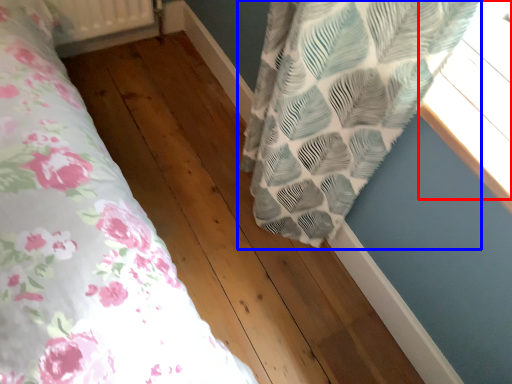
Question: Which of the following is the closest to the observer, window (highlighted by a red box) or curtain (highlighted by a blue box)?

Choices:
 (A) window
 (B) curtain

Answer: (A)